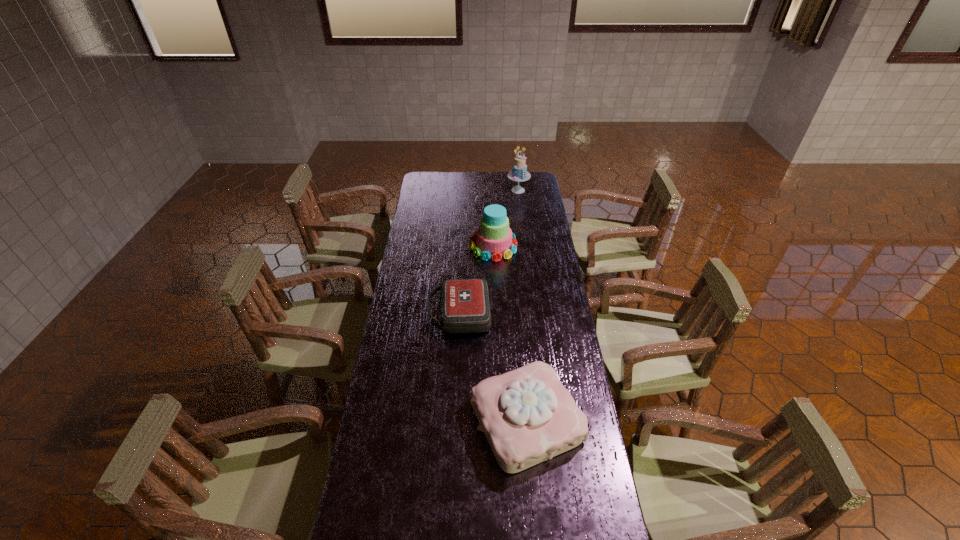
You are a GUI agent. You are given a task and a screenshot of the screen. Output one action in this format:
    pyautogui.click(x=<x>, y=<y>)
    Task: Click on the free space located 0.100m on the left of the shortest cake
    
    Given the screenshot: What is the action you would take?
    pyautogui.click(x=440, y=421)

The height and width of the screenshot is (540, 960). Identify the location of vacant space positioned on the back of the second nearest object. (462, 264).

Where is `object located in the far edge section of the desktop`? object located in the far edge section of the desktop is located at coordinates (519, 173).

Find the location of a particular element. The image size is (960, 540). object that is at the left edge is located at coordinates (464, 303).

Locate an element on the screen. This screenshot has height=540, width=960. object that is positioned at the far right corner is located at coordinates (519, 173).

Find the location of a particular element. vacant area at the far edge is located at coordinates (483, 186).

Find the location of `blank space at the left edge`. blank space at the left edge is located at coordinates (406, 335).

I want to click on vacant space at the right edge of the desktop, so click(x=534, y=326).

Identify the location of free spot between the nearest object and the farthest object. (522, 306).

Locate an element on the screen. The width and height of the screenshot is (960, 540). free point between the nearest object and the second tallest object is located at coordinates (510, 334).